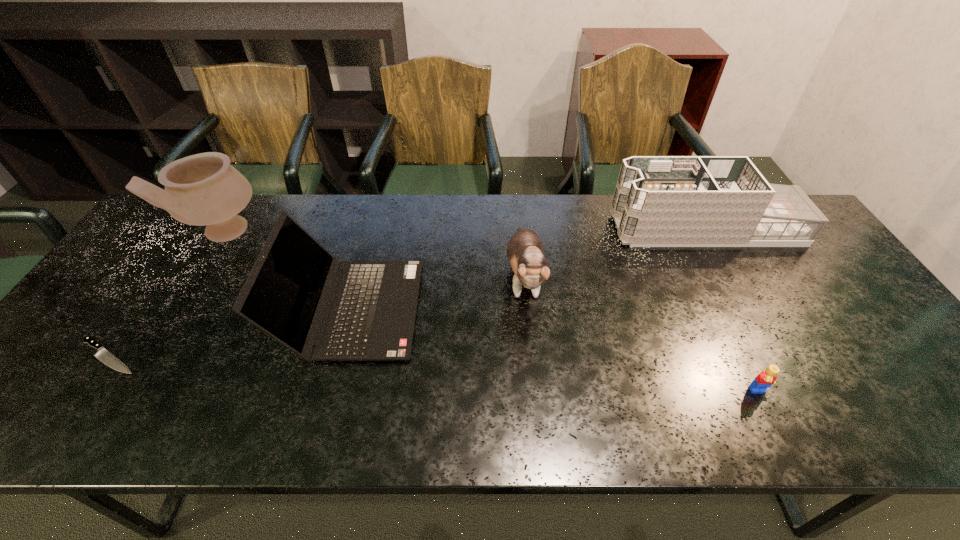
Locate an element on the screen. vacant area situated 0.130m at the entrance of the dollhouse is located at coordinates (571, 228).

I want to click on free space located 0.240m at the entrance of the dollhouse, so click(x=536, y=228).

Where is `free region located on the screen of the fourth object from right to left`? free region located on the screen of the fourth object from right to left is located at coordinates click(561, 309).

Where is `free spot located 0.080m on the face of the nearest object`? The height and width of the screenshot is (540, 960). free spot located 0.080m on the face of the nearest object is located at coordinates (780, 436).

Where is `vacant space located on the right of the shortest object`? This screenshot has height=540, width=960. vacant space located on the right of the shortest object is located at coordinates (259, 356).

What are the coordinates of `pottery located at the far edge` in the screenshot? It's located at (203, 189).

At what (x,y) coordinates should I click in order to perform the action: click on cat situated at the far edge. Please return your answer as a coordinate pair (x, y). The image size is (960, 540). Looking at the image, I should click on (525, 251).

Locate an element on the screen. The width and height of the screenshot is (960, 540). dollhouse that is at the far edge is located at coordinates (659, 201).

Image resolution: width=960 pixels, height=540 pixels. Find the location of `object positioned at the near edge`. object positioned at the near edge is located at coordinates (765, 379).

Identify the location of pottery at the left edge. This screenshot has height=540, width=960. (203, 189).